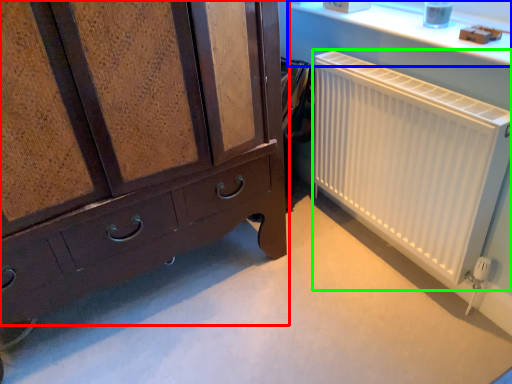
Question: Which object is the closest to the chest of drawers (highlighted by a red box)? Choose among these: window sill (highlighted by a blue box) or radiator (highlighted by a green box).

Choices:
 (A) window sill
 (B) radiator

Answer: (B)